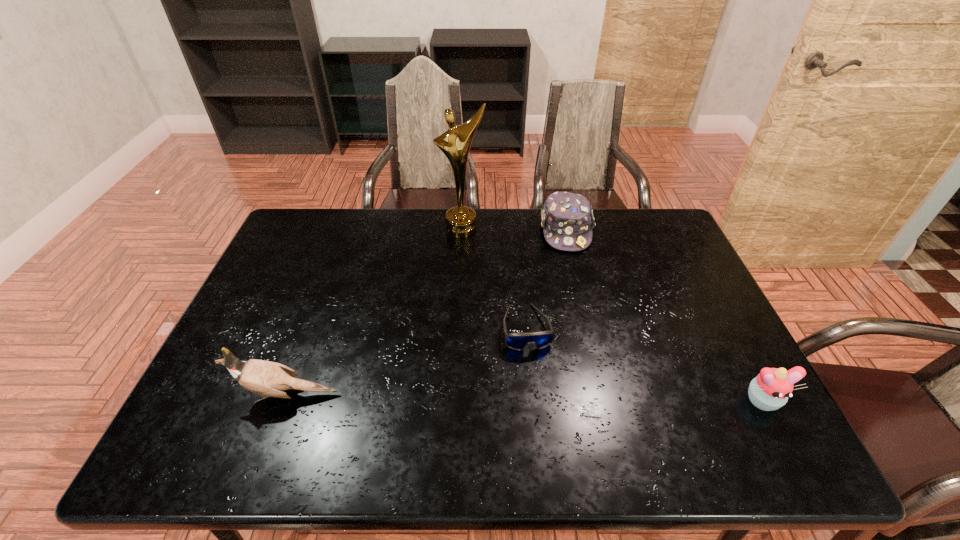
The height and width of the screenshot is (540, 960). I want to click on the fourth closest object relative to the bird, so click(770, 390).

I want to click on object that is the nearest to the award, so click(x=567, y=220).